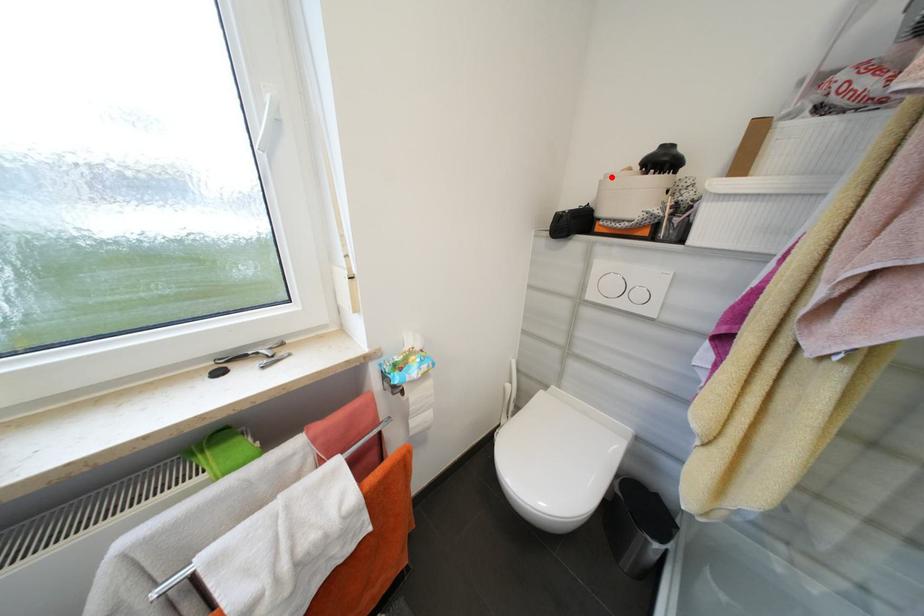
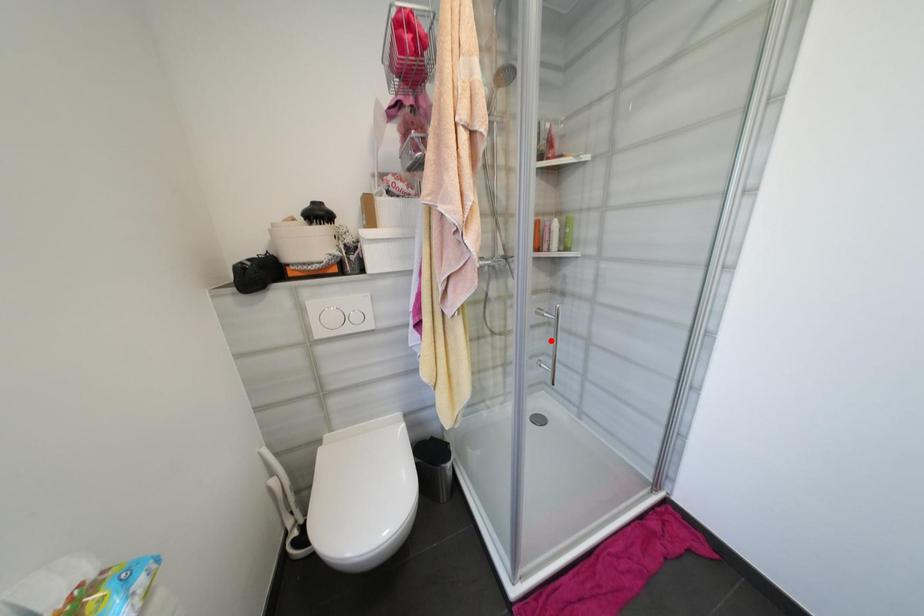
I am providing you with two images of the same scene from different viewpoints. A red point is marked on the first image and another point is marked on the second image. Are the points marked in image1 and image2 representing the same 3D position?

No